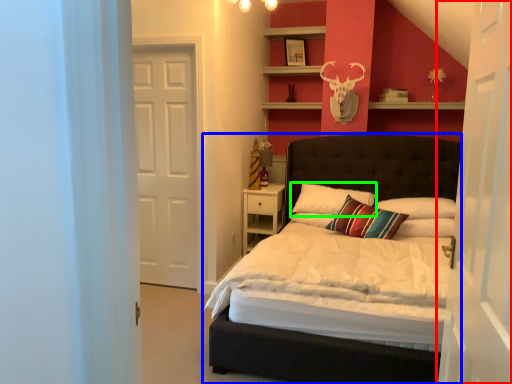
Question: Based on their relative distances, which object is farther from door (highlighted by a red box)? Choose from bed (highlighted by a blue box) and pillow (highlighted by a green box).

Choices:
 (A) bed
 (B) pillow

Answer: (A)